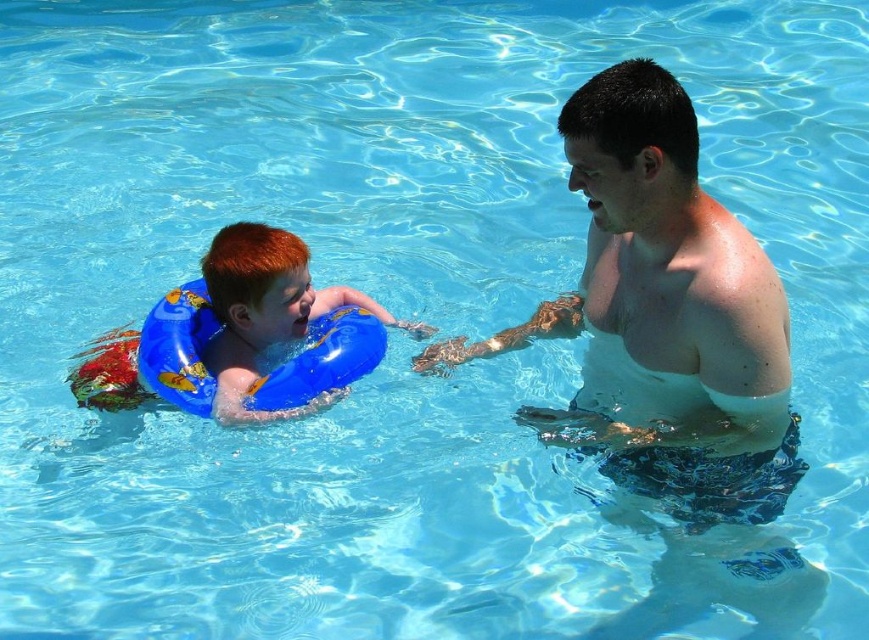
Who is positioned more to the right, blue rubber ring at left or blue inflatable ring at left?

blue inflatable ring at left is more to the right.

Is blue rubber ring at left wider than blue inflatable ring at left?

Yes, blue rubber ring at left is wider than blue inflatable ring at left.

Who is more forward, [209,305] or [164,344]?

Point [164,344] is more forward.

Locate an element on the screen. This screenshot has height=640, width=869. blue rubber ring at left is located at coordinates coord(242,337).

Does smooth skin man at center appear over blue rubber ring at left?

Actually, smooth skin man at center is below blue rubber ring at left.

Is smooth skin man at center in front of blue rubber ring at left?

Yes.

Describe the element at coordinates (668, 349) in the screenshot. I see `smooth skin man at center` at that location.

Identify the location of smooth skin man at center. The image size is (869, 640). (668, 349).

In the scene shown: Is smooth skin man at center wider than blue inflatable ring at left?

Yes, smooth skin man at center is wider than blue inflatable ring at left.

Is smooth skin man at center thinner than blue inflatable ring at left?

In fact, smooth skin man at center might be wider than blue inflatable ring at left.

In order to click on smooth skin man at center in this screenshot , I will do `click(668, 349)`.